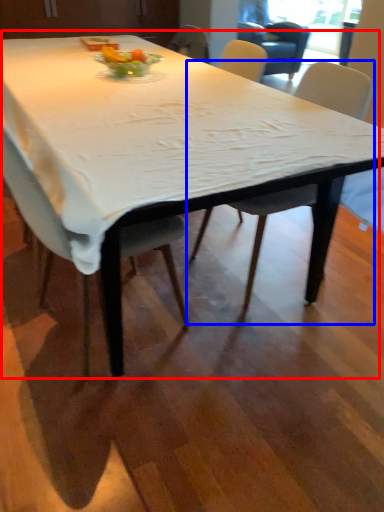
Question: Which object appears farthest to the camera in this image, table (highlighted by a red box) or chair (highlighted by a blue box)?

Choices:
 (A) table
 (B) chair

Answer: (B)